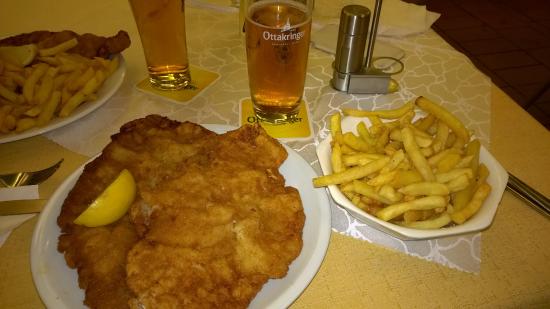
You are a GUI agent. You are given a task and a screenshot of the screen. Output one action in this format:
    pyautogui.click(x=<x>, y=<y>)
    Task: Click on the tabletop
    
    Given the screenshot: What is the action you would take?
    pyautogui.click(x=406, y=274)